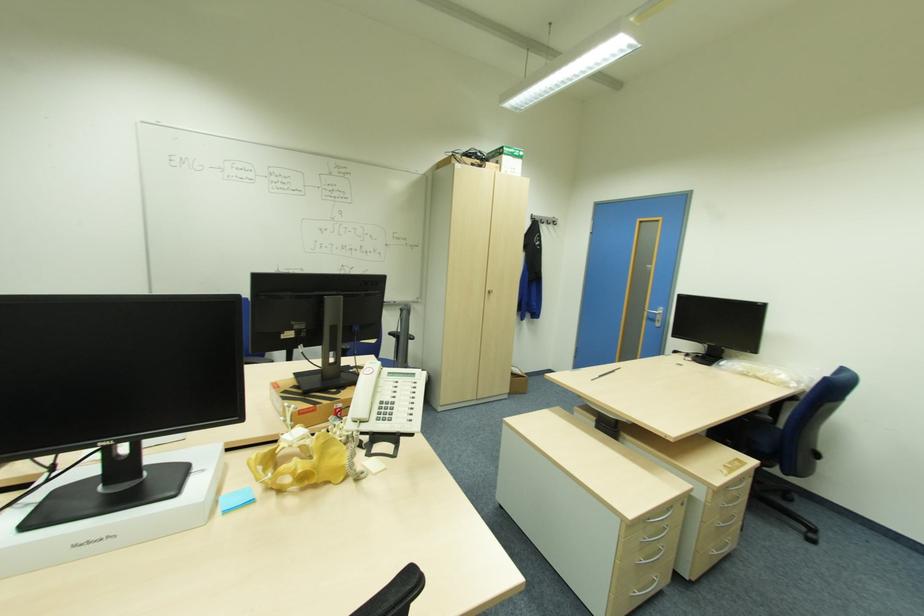
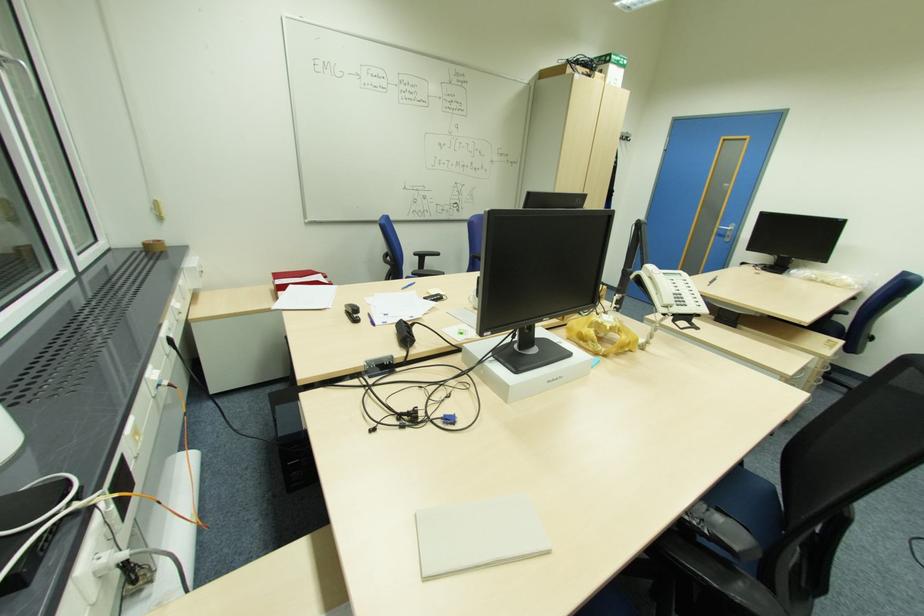
The point at (381, 419) is marked in the first image. Where is the corresponding point in the second image?

(681, 305)